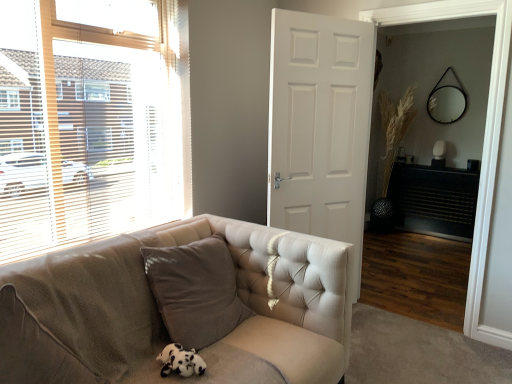
Question: Considering the positions of wooden blinds at left and wooden screen door at center in the image, is wooden blinds at left wider or thinner than wooden screen door at center?

Choices:
 (A) wide
 (B) thin

Answer: (B)

Question: Is wooden blinds at left spatially inside wooden screen door at center, or outside of it?

Choices:
 (A) inside
 (B) outside

Answer: (B)

Question: Estimate the real-world distances between objects in this image. Which object is closer to the tufted fabric couch at center?

Choices:
 (A) brown fabric pillow at lower center
 (B) black textured fireplace at right
 (C) white matte door at center
 (D) wooden blinds at left
 (E) wooden screen door at center

Answer: (A)

Question: Based on their relative distances, which object is nearer to the wooden blinds at left?

Choices:
 (A) black plush toy at lower left
 (B) black textured fireplace at right
 (C) white matte door at center
 (D) brown fabric pillow at lower center
 (E) tufted fabric couch at center

Answer: (E)